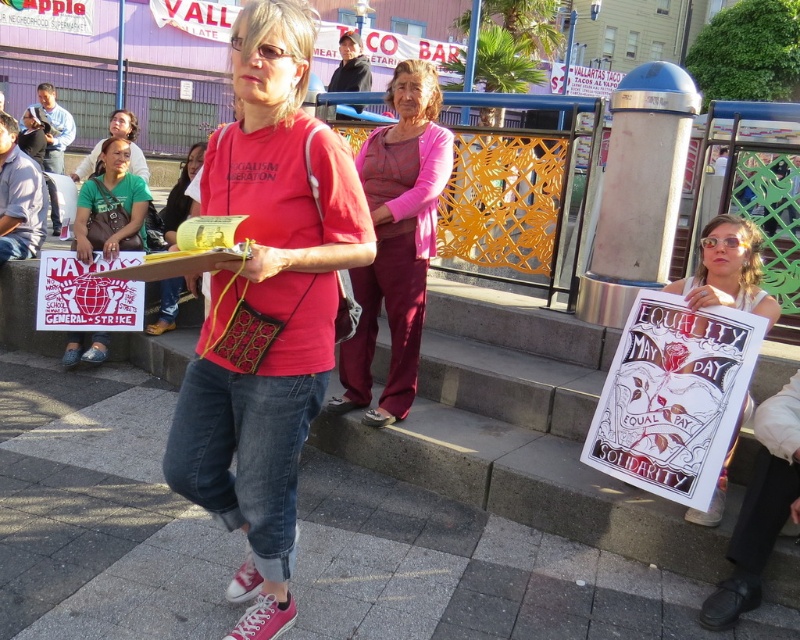
You are standing at the entrance of the building and want to hand out flyers to people in the scene. The woman with the green fabric shirt at lower left is seated on the steps. Which direction should you walk to reach her first without passing by the woman in the red tshirt with SOCIALISM FEDERATION?

The green fabric shirt at lower left is located at point (110, 205), so you should walk to the left side from the entrance to reach her before the woman in the red tshirt with SOCIALISM FEDERATION.

You are a photographer trying to capture the protest scene. You notice the green fabric shirt at lower left and the matte yellow purse at center. Which object is positioned higher in the image?

The green fabric shirt at lower left is above the matte yellow purse at center, so it is positioned higher in the image.